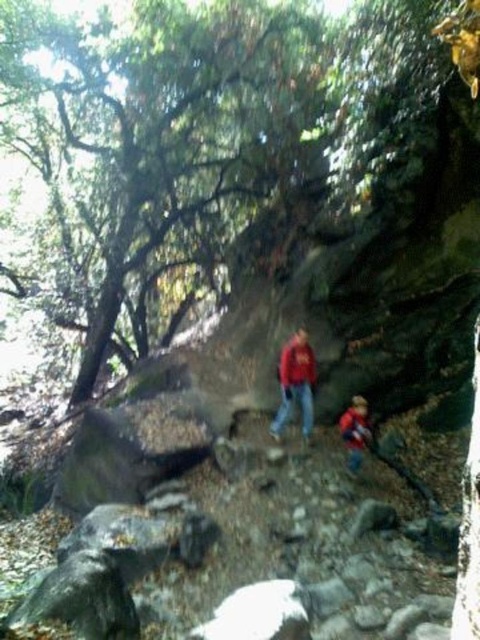
Is red matte shirt at center thinner than matte red jacket at center?

No.

Is red matte shirt at center taller than matte red jacket at center?

Correct, red matte shirt at center is much taller as matte red jacket at center.

Image resolution: width=480 pixels, height=640 pixels. Describe the element at coordinates (296, 384) in the screenshot. I see `red matte shirt at center` at that location.

The image size is (480, 640). In order to click on red matte shirt at center in this screenshot , I will do `click(296, 384)`.

Does green leafy tree at upper left have a lesser height compared to red fabric jacket at lower center?

Indeed, green leafy tree at upper left has a lesser height compared to red fabric jacket at lower center.

The height and width of the screenshot is (640, 480). Describe the element at coordinates (155, 157) in the screenshot. I see `green leafy tree at upper left` at that location.

Locate an element on the screen. The image size is (480, 640). green leafy tree at upper left is located at coordinates (155, 157).

Can you confirm if red matte shirt at center is bigger than red fabric jacket at lower center?

Yes, red matte shirt at center is bigger than red fabric jacket at lower center.

The image size is (480, 640). What do you see at coordinates (296, 384) in the screenshot?
I see `red matte shirt at center` at bounding box center [296, 384].

This screenshot has height=640, width=480. Identify the location of red matte shirt at center. (296, 384).